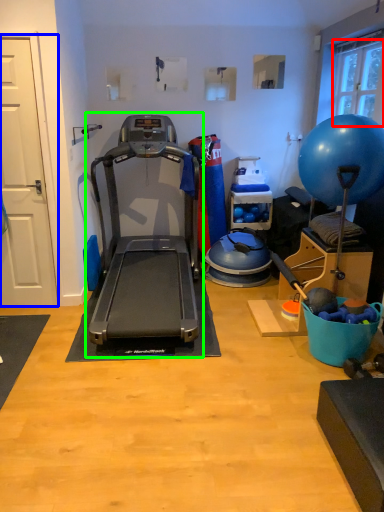
Question: Which is nearer to the window screen (highlighted by a red box)? door (highlighted by a blue box) or treadmill (highlighted by a green box).

Choices:
 (A) door
 (B) treadmill

Answer: (B)